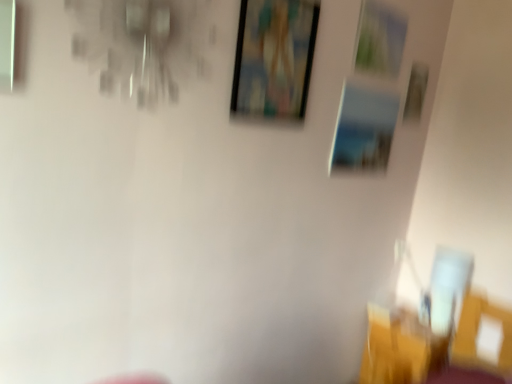
Question: Is there a large distance between yellow fabric chair at lower right and wooden picture frame at upper center, the 4th picture frame from the right?

Choices:
 (A) no
 (B) yes

Answer: (B)

Question: Is yellow fabric chair at lower right turned away from wooden picture frame at upper center, the 4th picture frame from the right?

Choices:
 (A) no
 (B) yes

Answer: (A)

Question: Does yellow fabric chair at lower right have a larger size compared to wooden picture frame at upper center, the 4th picture frame from the right?

Choices:
 (A) yes
 (B) no

Answer: (A)

Question: Does yellow fabric chair at lower right have a lesser width compared to wooden picture frame at upper center, which is the first picture frame in left-to-right order?

Choices:
 (A) no
 (B) yes

Answer: (A)

Question: Is yellow fabric chair at lower right beside wooden picture frame at upper center, the 4th picture frame from the right?

Choices:
 (A) no
 (B) yes

Answer: (A)

Question: In the image, is metallic silver picture frame at upper right, the second picture frame viewed from the right, positioned in front of or behind metallic silver picture frame at upper center, which is the second picture frame from left to right?

Choices:
 (A) front
 (B) behind

Answer: (A)

Question: Is metallic silver picture frame at upper right, the second picture frame viewed from the right, wider or thinner than metallic silver picture frame at upper center, which appears as the 3th picture frame when viewed from the right?

Choices:
 (A) thin
 (B) wide

Answer: (A)

Question: From the image's perspective, relative to metallic silver picture frame at upper center, which appears as the 3th picture frame when viewed from the right, is metallic silver picture frame at upper right, the second picture frame viewed from the right, above or below?

Choices:
 (A) above
 (B) below

Answer: (A)

Question: From a real-world perspective, is metallic silver picture frame at upper right, the third picture frame in the left-to-right sequence, physically located above or below metallic silver picture frame at upper center, which appears as the 3th picture frame when viewed from the right?

Choices:
 (A) below
 (B) above

Answer: (B)

Question: Is yellow fabric chair at lower right bigger or smaller than wooden picture frame at upper right, the 1th picture frame positioned from the right?

Choices:
 (A) small
 (B) big

Answer: (B)

Question: From the image's perspective, relative to wooden picture frame at upper right, which is counted as the fourth picture frame, starting from the left, is yellow fabric chair at lower right above or below?

Choices:
 (A) above
 (B) below

Answer: (B)

Question: Do you think yellow fabric chair at lower right is within wooden picture frame at upper right, which is counted as the fourth picture frame, starting from the left, or outside of it?

Choices:
 (A) inside
 (B) outside

Answer: (B)

Question: In terms of height, does yellow fabric chair at lower right look taller or shorter compared to wooden picture frame at upper right, the 1th picture frame positioned from the right?

Choices:
 (A) short
 (B) tall

Answer: (B)

Question: Relative to metallic silver picture frame at upper right, the second picture frame viewed from the right, is wooden picture frame at upper right, which is counted as the fourth picture frame, starting from the left, in front or behind?

Choices:
 (A) behind
 (B) front

Answer: (A)

Question: From a real-world perspective, is wooden picture frame at upper right, which is counted as the fourth picture frame, starting from the left, positioned above or below metallic silver picture frame at upper right, the third picture frame in the left-to-right sequence?

Choices:
 (A) above
 (B) below

Answer: (B)